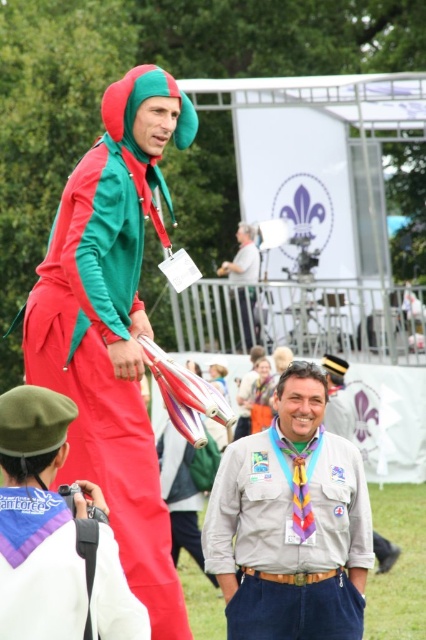
Does matte green and red tracksuit at center have a smaller size compared to matte green and red jumpsuit at center?

Actually, matte green and red tracksuit at center might be larger than matte green and red jumpsuit at center.

Consider the image. Can you confirm if matte green and red tracksuit at center is positioned above matte green and red jumpsuit at center?

Yes, matte green and red tracksuit at center is above matte green and red jumpsuit at center.

At what (x,y) coordinates should I click in order to perform the action: click on matte green and red tracksuit at center. Please return your answer as a coordinate pair (x, y). Looking at the image, I should click on (112, 326).

I want to click on matte green and red tracksuit at center, so click(x=112, y=326).

Who is more distant from viewer, (39, 304) or (268, 461)?

Positioned behind is point (268, 461).

What do you see at coordinates (112, 326) in the screenshot? I see `matte green and red tracksuit at center` at bounding box center [112, 326].

Between point (137, 454) and point (249, 621), which one is positioned in front?

Positioned in front is point (137, 454).

Locate an element on the screen. matte green and red tracksuit at center is located at coordinates (112, 326).

Between point (345, 502) and point (258, 250), which one is positioned behind?

The point (258, 250) is behind.

Which is behind, point (360, 605) or point (250, 269)?

The point (250, 269) is more distant.

Image resolution: width=426 pixels, height=640 pixels. Identify the location of khaki cotton shirt at center. (290, 524).